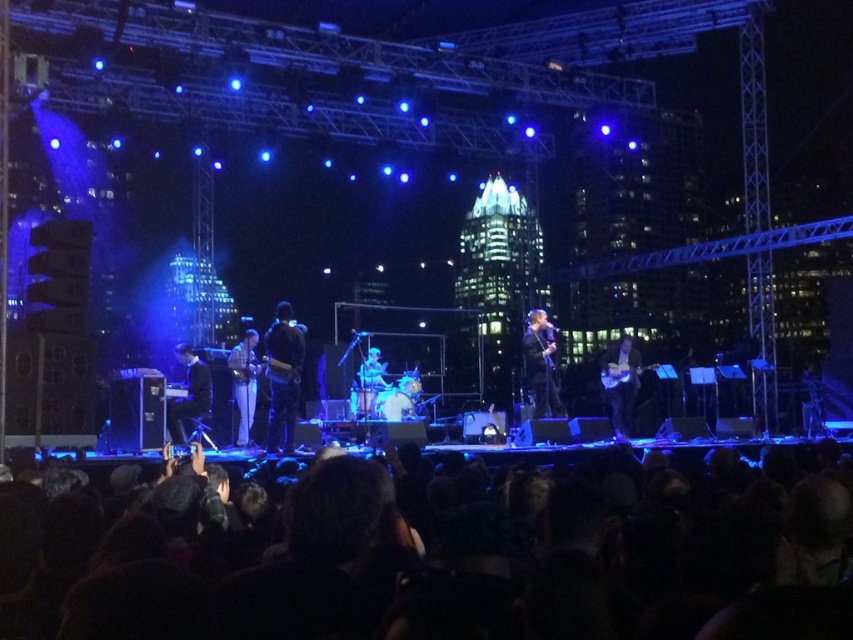
Which of these two, matte black guitar at right or matte blue drum set at center, stands taller?

With more height is matte black guitar at right.

From the picture: Between matte black guitar at right and matte blue drum set at center, which one appears on the right side from the viewer's perspective?

matte black guitar at right

Locate an element on the screen. matte black guitar at right is located at coordinates (621, 381).

Is point (537, 401) positioned before point (358, 372)?

Yes, it is in front of point (358, 372).

Can you confirm if shiny black jacket at center is smaller than matte blue drum set at center?

Actually, shiny black jacket at center might be larger than matte blue drum set at center.

Find the location of a particular element. The height and width of the screenshot is (640, 853). shiny black jacket at center is located at coordinates (541, 364).

Can you confirm if black fabric crowd at lower center is thinner than shiny black piano at left?

In fact, black fabric crowd at lower center might be wider than shiny black piano at left.

Between black fabric crowd at lower center and shiny black piano at left, which one is positioned higher?

shiny black piano at left

Does point (502, 515) come closer to viewer compared to point (196, 384)?

Yes, point (502, 515) is closer to viewer.

Locate an element on the screen. The width and height of the screenshot is (853, 640). black fabric crowd at lower center is located at coordinates (439, 561).